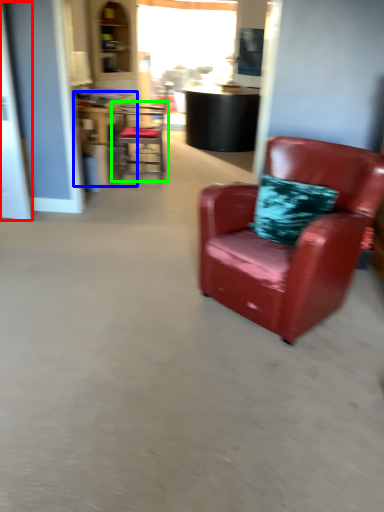
Question: Based on their relative distances, which object is farther from glass door (highlighted by a red box)? Choose from table (highlighted by a blue box) and chair (highlighted by a green box).

Choices:
 (A) table
 (B) chair

Answer: (B)